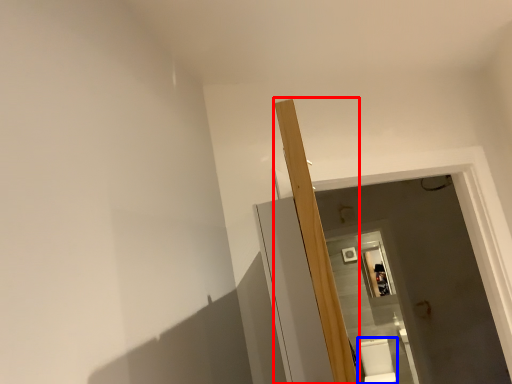
Question: Which of the following is the closest to the observer, beam (highlighted by a red box) or toilet bowl (highlighted by a blue box)?

Choices:
 (A) beam
 (B) toilet bowl

Answer: (A)